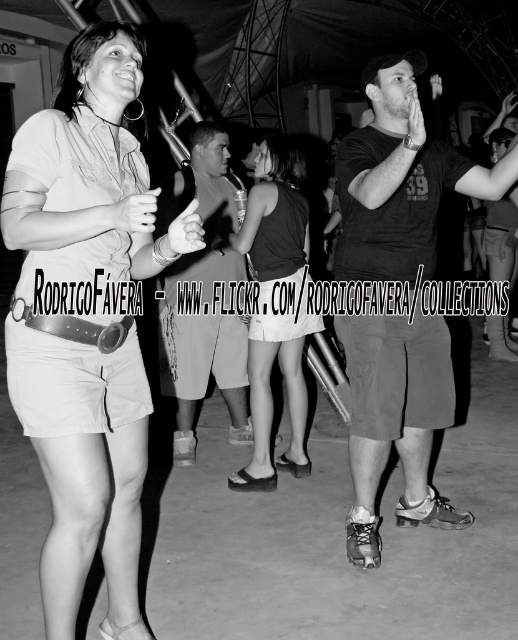
Based on the scene description, where is the matte khaki shorts at left located in the image?

The matte khaki shorts at left is located at point (89, 176) in the image.

You are standing at the camera position and want to throw a small ball to the point marked as point (416, 435). Can you estimate how far you need to throw the ball in feet?

The distance of point (416, 435) from camera is 9.80 feet, so you need to throw the ball approximately 9.80 feet.

You are a photographer at the event and need to adjust the lighting so that both the matte khaki shorts at left and the smooth black dress at center are well lit. Considering their heights, which one might require a higher light source to ensure proper illumination?

The matte khaki shorts at left is much taller than the smooth black dress at center, so the higher light source should be aimed at the matte khaki shorts at left to ensure it is properly illuminated.